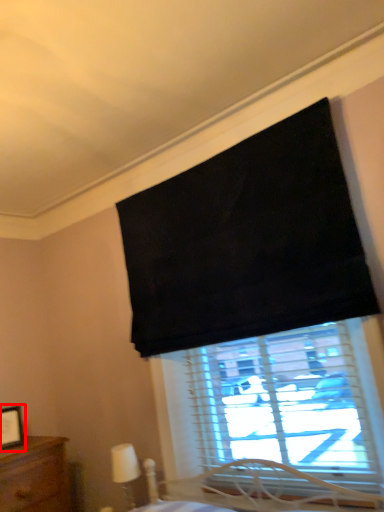
Question: From the image's perspective, where is picture frame (annotated by the red box) located in relation to table lamp in the image?

Choices:
 (A) above
 (B) below

Answer: (A)